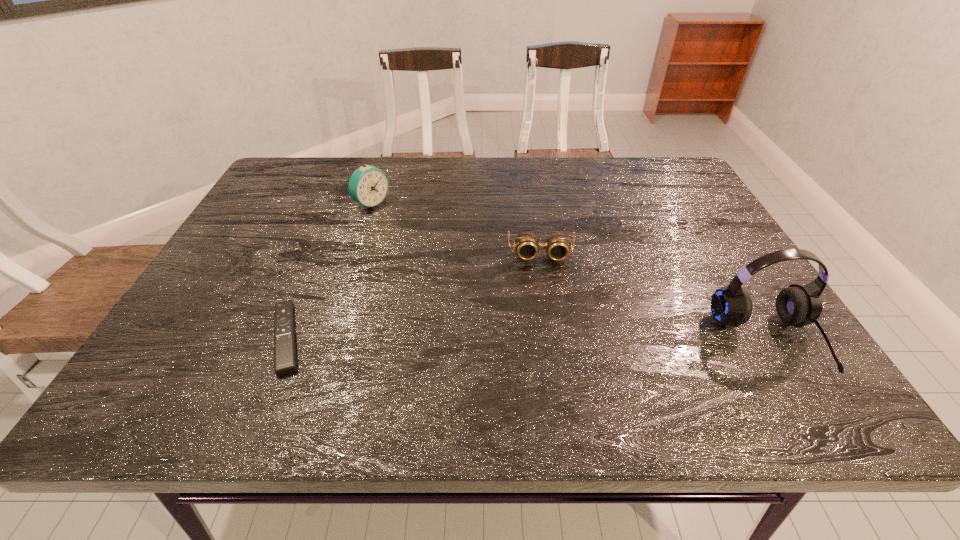
Find the location of `vacant space at the near edge`. vacant space at the near edge is located at coordinates (341, 367).

Where is `vacant space at the right edge of the desktop`? The height and width of the screenshot is (540, 960). vacant space at the right edge of the desktop is located at coordinates (x=683, y=276).

Locate an element on the screen. vacant region at the far right corner of the desktop is located at coordinates (678, 177).

I want to click on empty location between the headset and the remote control, so click(x=527, y=339).

The height and width of the screenshot is (540, 960). I want to click on empty location between the remote control and the alarm clock, so click(329, 271).

I want to click on vacant space in between the second tallest object and the remote control, so click(x=329, y=271).

Where is `free space between the remote control and the tallest object`? The width and height of the screenshot is (960, 540). free space between the remote control and the tallest object is located at coordinates (527, 339).

I want to click on empty space between the second object from right to left and the rightmost object, so click(x=655, y=298).

The height and width of the screenshot is (540, 960). What are the coordinates of `empty location between the second object from right to left and the shortest object` in the screenshot? It's located at (414, 296).

I want to click on unoccupied area between the tallest object and the alarm clock, so click(570, 272).